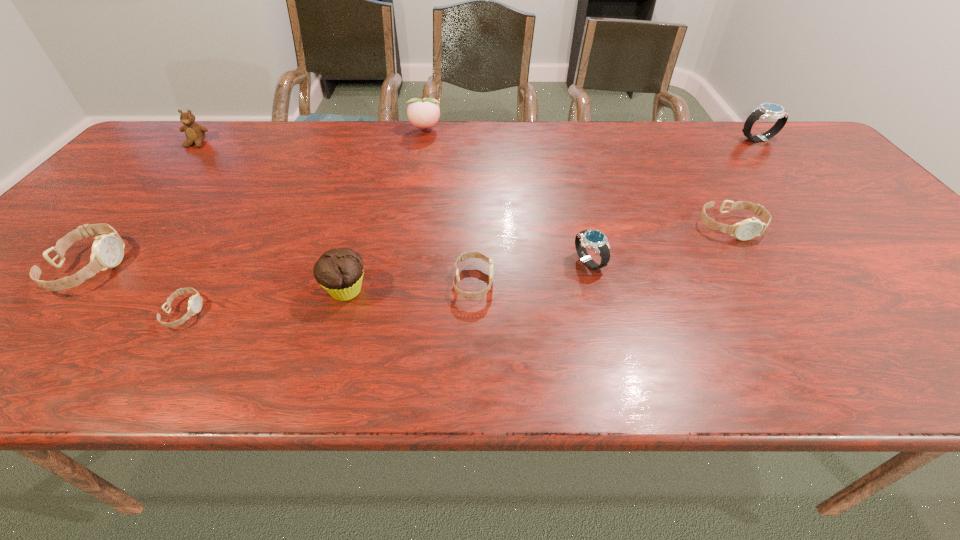
At what (x,y) coordinates should I click in order to perform the action: click on object that is the fourth closest to the third watch from right to left. Please return your answer as a coordinate pair (x, y). This screenshot has width=960, height=540. Looking at the image, I should click on (424, 113).

The image size is (960, 540). I want to click on the sixth closest watch to the fifth object from right to left, so click(x=766, y=110).

In order to click on watch object that ranks as the second closest to the bigger silver watch in this screenshot , I will do `click(593, 239)`.

The width and height of the screenshot is (960, 540). What are the coordinates of `beige watch that is the second closest to the shortest object` in the screenshot? It's located at (465, 255).

Image resolution: width=960 pixels, height=540 pixels. I want to click on the closest beige watch relative to the pink peach, so click(x=465, y=255).

This screenshot has height=540, width=960. In order to click on free spot that satisfies the following two spatial constraints: 1. at the face of the chocolate muffin; 2. on the right side of the teddy bear in this screenshot , I will do `click(68, 291)`.